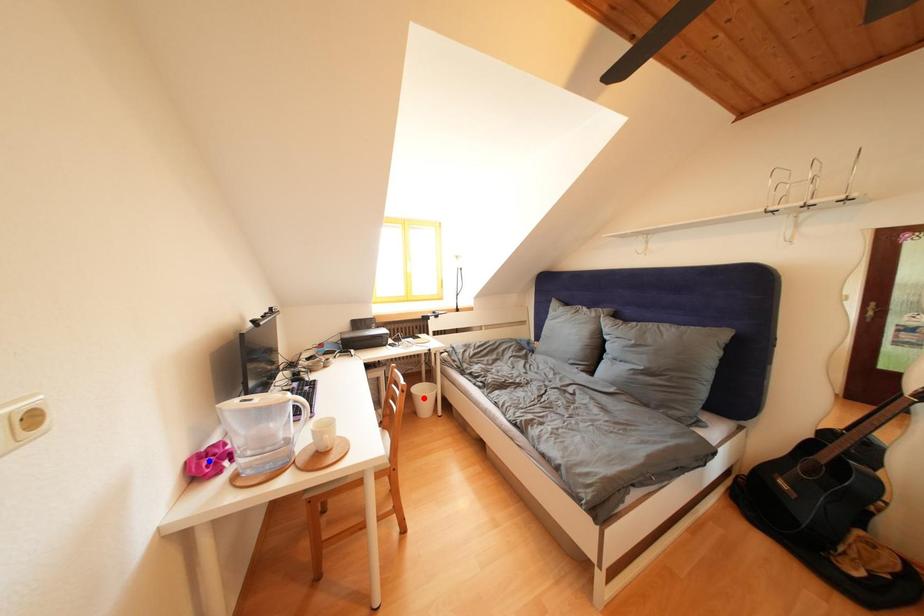
Question: Which of the two points in the image is closer to the camera?

Choices:
 (A) Blue point is closer.
 (B) Red point is closer.

Answer: (A)